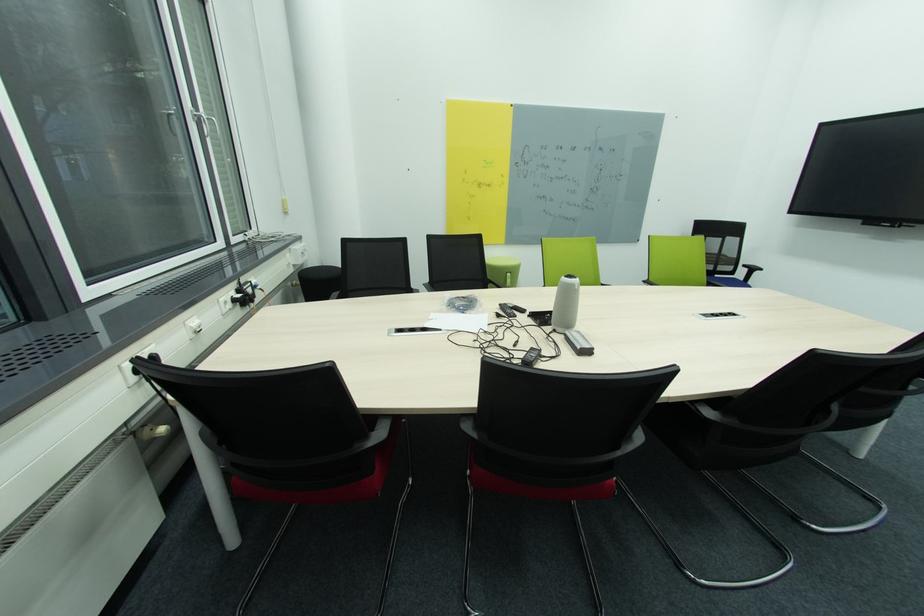
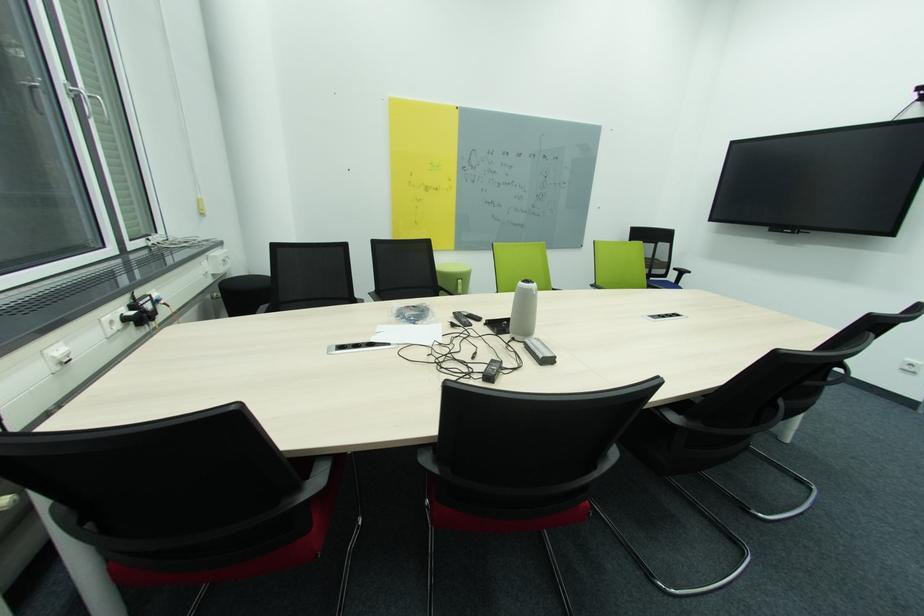
Find the pixel in the second image that matches (537,350) in the first image.

(497, 362)